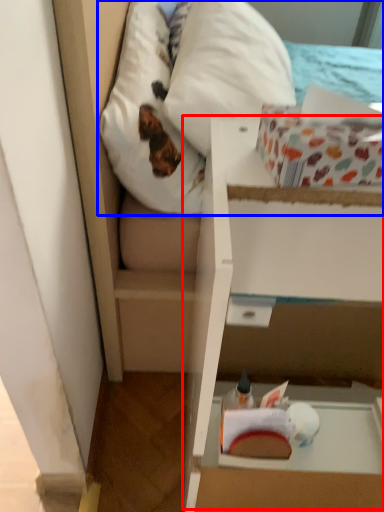
Question: Which point is closer to the camera, cardboard box (highlighted by a red box) or mattress (highlighted by a blue box)?

Choices:
 (A) cardboard box
 (B) mattress

Answer: (A)